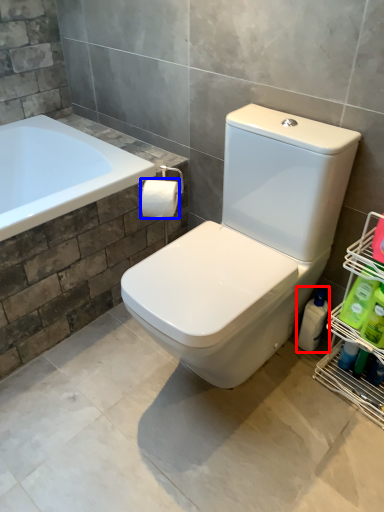
Question: Which object is closer to the camera taking this photo, cleaning product (highlighted by a red box) or toilet paper (highlighted by a blue box)?

Choices:
 (A) cleaning product
 (B) toilet paper

Answer: (B)